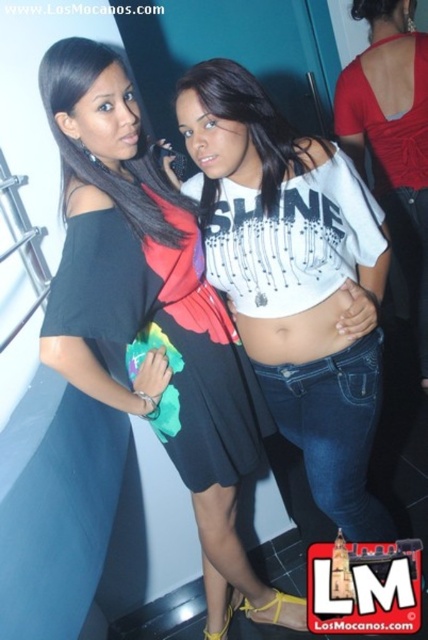
Between black matte dress at center and matte black dress at center, which one is positioned lower?

black matte dress at center is below.

Can you confirm if black matte dress at center is thinner than matte black dress at center?

Incorrect, black matte dress at center's width is not less than matte black dress at center's.

The height and width of the screenshot is (640, 428). I want to click on black matte dress at center, so point(151,316).

Who is more forward, (139, 138) or (306, 358)?

Point (139, 138) is more forward.

This screenshot has width=428, height=640. What do you see at coordinates (89, 150) in the screenshot?
I see `matte black dress at center` at bounding box center [89, 150].

I want to click on matte black dress at center, so click(x=89, y=150).

Which is in front, point (95, 109) or point (287, 342)?

Point (95, 109)

Does point (202, 364) come closer to viewer compared to point (303, 330)?

No, (202, 364) is behind (303, 330).

Identify the location of black matte dress at center. (151, 316).